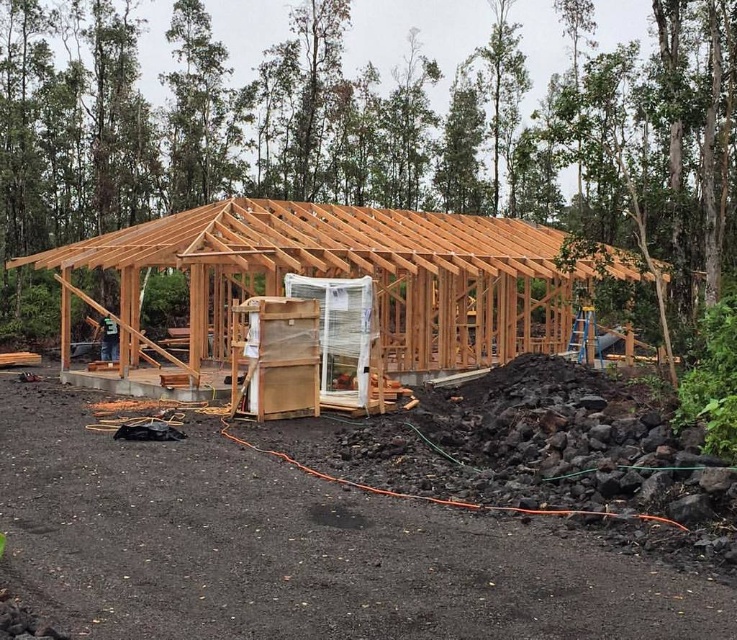
This screenshot has height=640, width=737. What are the coordinates of `natural wood frame at center` in the screenshot? It's located at [357, 275].

Looking at this image, who is higher up, natural wood frame at center or natural wood roof at center?

Positioned higher is natural wood roof at center.

This screenshot has width=737, height=640. Describe the element at coordinates (357, 275) in the screenshot. I see `natural wood frame at center` at that location.

I want to click on natural wood frame at center, so click(357, 275).